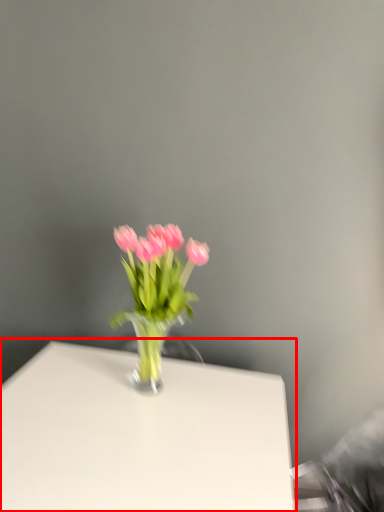
Question: From the image's perspective, what is the correct spatial positioning of table (annotated by the red box) in reference to floral arrangement?

Choices:
 (A) above
 (B) below

Answer: (B)